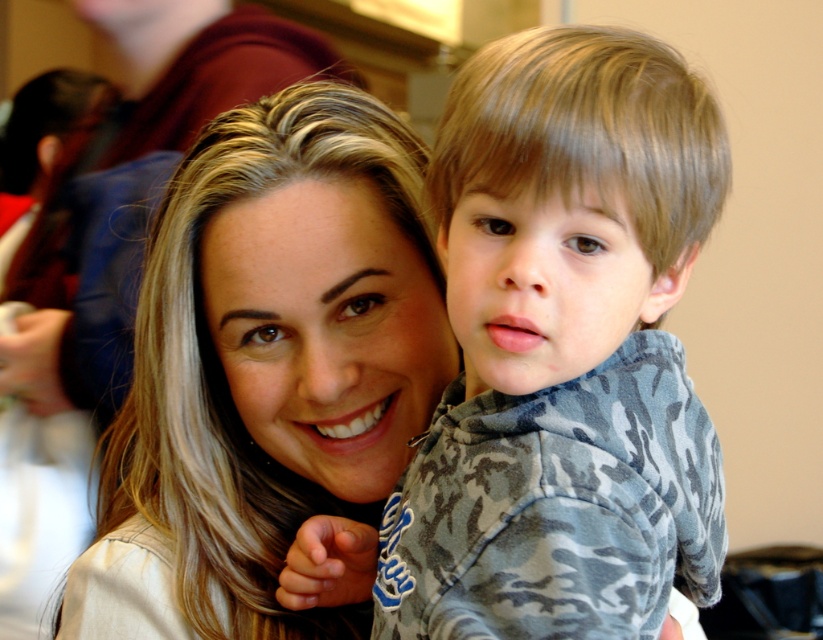
Question: Which point appears farthest from the camera in this image?

Choices:
 (A) (698, 99)
 (B) (250, 161)

Answer: (B)

Question: Among these points, which one is farthest from the camera?

Choices:
 (A) (447, 184)
 (B) (398, 131)

Answer: (B)

Question: Does camouflage fleece at center have a larger size compared to smooth blonde hair at center?

Choices:
 (A) yes
 (B) no

Answer: (B)

Question: Can you confirm if camouflage fleece at center is positioned above smooth blonde hair at center?

Choices:
 (A) no
 (B) yes

Answer: (A)

Question: Can you confirm if camouflage fleece at center is smaller than smooth blonde hair at center?

Choices:
 (A) no
 (B) yes

Answer: (B)